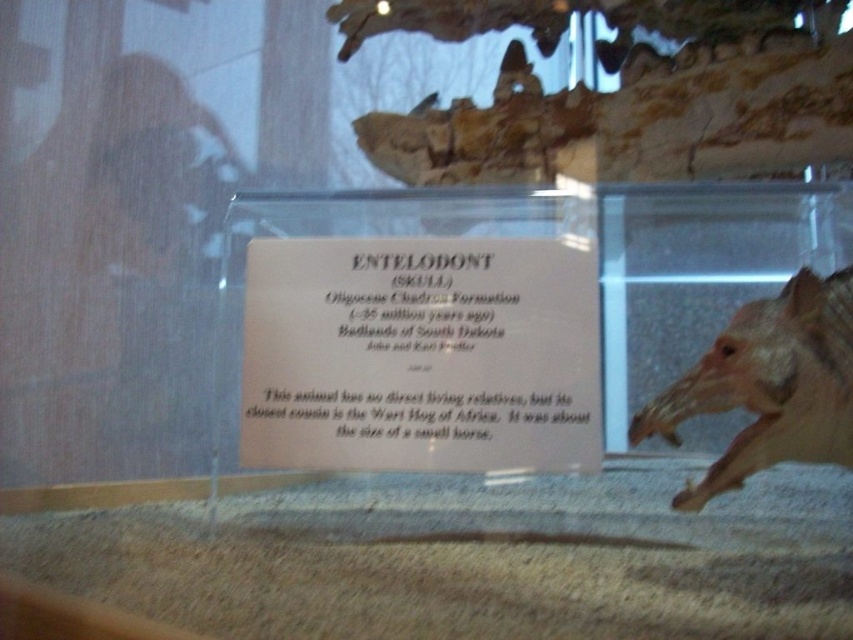
Question: Can you confirm if white paper at center is positioned below light brown bone at right?

Choices:
 (A) yes
 (B) no

Answer: (B)

Question: Does white paper at center have a greater width compared to light brown bone at right?

Choices:
 (A) no
 (B) yes

Answer: (B)

Question: Can you confirm if white paper at center is wider than light brown bone at right?

Choices:
 (A) yes
 (B) no

Answer: (A)